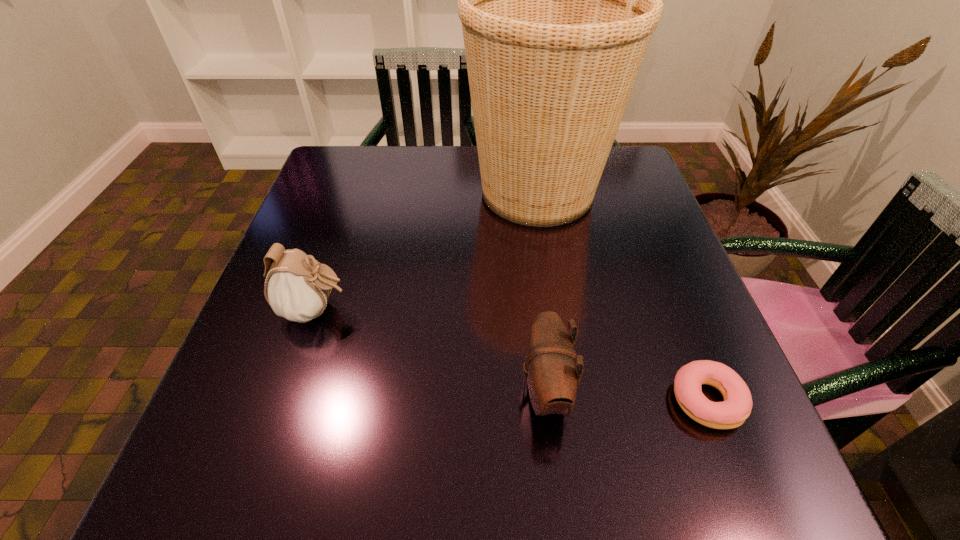
Image resolution: width=960 pixels, height=540 pixels. What are the coordinates of `free space that is in between the farthest object and the shortest object` in the screenshot? It's located at (622, 296).

This screenshot has width=960, height=540. In order to click on free space between the leftmost object and the doughnut in this screenshot , I will do `click(511, 355)`.

Find the location of a particular element. This screenshot has height=540, width=960. vacant region between the nearer pouch and the basket is located at coordinates (541, 291).

Locate an element on the screen. Image resolution: width=960 pixels, height=540 pixels. object that is the third closest to the right pouch is located at coordinates (298, 289).

Where is `object that is the second closest to the shortest object`? object that is the second closest to the shortest object is located at coordinates (558, 0).

You are a GUI agent. You are given a task and a screenshot of the screen. Output one action in this format:
    pyautogui.click(x=<x>, y=<y>)
    Task: Click on the free space that satisfies the following two spatial constraints: 1. on the front-facing side of the doughnut; 2. on the left side of the third nearest object
    The width and height of the screenshot is (960, 540).
    Given the screenshot: What is the action you would take?
    pyautogui.click(x=286, y=400)

Locate an element on the screen. vacant region that satisfies the following two spatial constraints: 1. on the front side of the tallest object; 2. on the front-facing side of the leftmost object is located at coordinates (556, 310).

Find the location of a particular element. vacant point that satisfies the following two spatial constraints: 1. on the front side of the basket; 2. with the flap open on the nearer pouch is located at coordinates (568, 390).

In order to click on vacant space that satisfies the following two spatial constraints: 1. with the flap open on the nearer pouch; 2. on the back side of the shortest object in this screenshot , I will do `click(546, 400)`.

You are a GUI agent. You are given a task and a screenshot of the screen. Output one action in this format:
    pyautogui.click(x=<x>, y=<y>)
    Task: Click on the vacant region that satisfies the following two spatial constraints: 1. with the flap open on the doughnut; 2. on the left side of the nearer pouch
    The height and width of the screenshot is (540, 960).
    Given the screenshot: What is the action you would take?
    pyautogui.click(x=546, y=400)